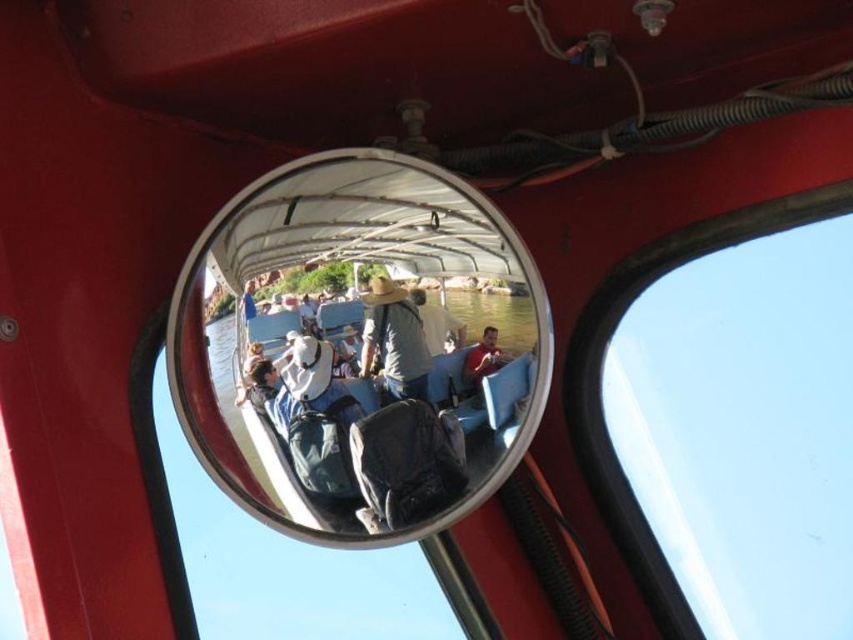
Looking at this image, you are standing at the point marked as point (x=308, y=353) in the convex mirror. You want to reach the door that is 3.86 feet away from you. Is the door located inside the red vehicle or outside the red vehicle?

The door is located inside the red vehicle because the distance of 3.86 feet from point (x=308, y=353) in the convex mirror suggests it is within the enclosed space of the vehicle.

You are inside the red vehicle and want to check the surroundings using the metallic reflective mirror at center. Based on its position, can you estimate where exactly the mirror is placed relative to the cabin?

The metallic reflective mirror at center is located at point 0.545 on the x axis and 0.430 on the y axis, so it is positioned centrally within the cabin, slightly towards the front.

Looking at this image, you are standing in the boat cabin and want to place a new hat exactly where the light brown straw hat at center is currently located. What coordinates should you use to place the new hat?

You should place the new hat at coordinates point (393, 340) where the light brown straw hat at center is located.